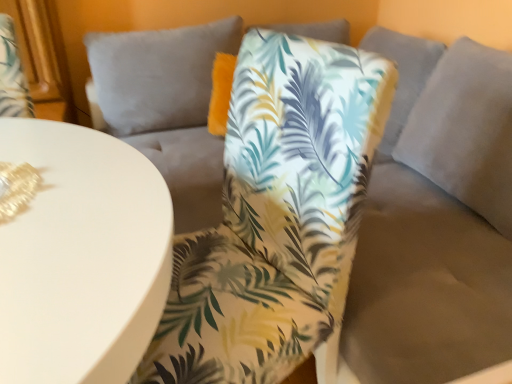
Question: From a real-world perspective, is white glossy table at lower left on palm leaf fabric chair at center?

Choices:
 (A) no
 (B) yes

Answer: (A)

Question: Does white glossy table at lower left appear on the right side of palm leaf fabric chair at center?

Choices:
 (A) yes
 (B) no

Answer: (B)

Question: Is white glossy table at lower left oriented towards palm leaf fabric chair at center?

Choices:
 (A) yes
 (B) no

Answer: (A)

Question: From the image's perspective, does white glossy table at lower left appear higher than palm leaf fabric chair at center?

Choices:
 (A) no
 (B) yes

Answer: (A)

Question: Considering the relative sizes of white glossy table at lower left and palm leaf fabric chair at center in the image provided, is white glossy table at lower left smaller than palm leaf fabric chair at center?

Choices:
 (A) yes
 (B) no

Answer: (B)

Question: Is white glossy table at lower left taller than palm leaf fabric chair at center?

Choices:
 (A) no
 (B) yes

Answer: (A)

Question: From a real-world perspective, is palm leaf fabric chair at center positioned over white glossy table at lower left based on gravity?

Choices:
 (A) no
 (B) yes

Answer: (B)

Question: Does palm leaf fabric chair at center have a lesser width compared to white glossy table at lower left?

Choices:
 (A) yes
 (B) no

Answer: (A)

Question: Is palm leaf fabric chair at center not close to white glossy table at lower left?

Choices:
 (A) no
 (B) yes

Answer: (A)

Question: Can you confirm if palm leaf fabric chair at center is taller than white glossy table at lower left?

Choices:
 (A) yes
 (B) no

Answer: (A)

Question: Does palm leaf fabric chair at center have a larger size compared to white glossy table at lower left?

Choices:
 (A) yes
 (B) no

Answer: (B)

Question: Is palm leaf fabric chair at center positioned behind white glossy table at lower left?

Choices:
 (A) no
 (B) yes

Answer: (B)

Question: From a real-world perspective, relative to white glossy table at lower left, is palm leaf fabric chair at center vertically above or below?

Choices:
 (A) above
 (B) below

Answer: (A)